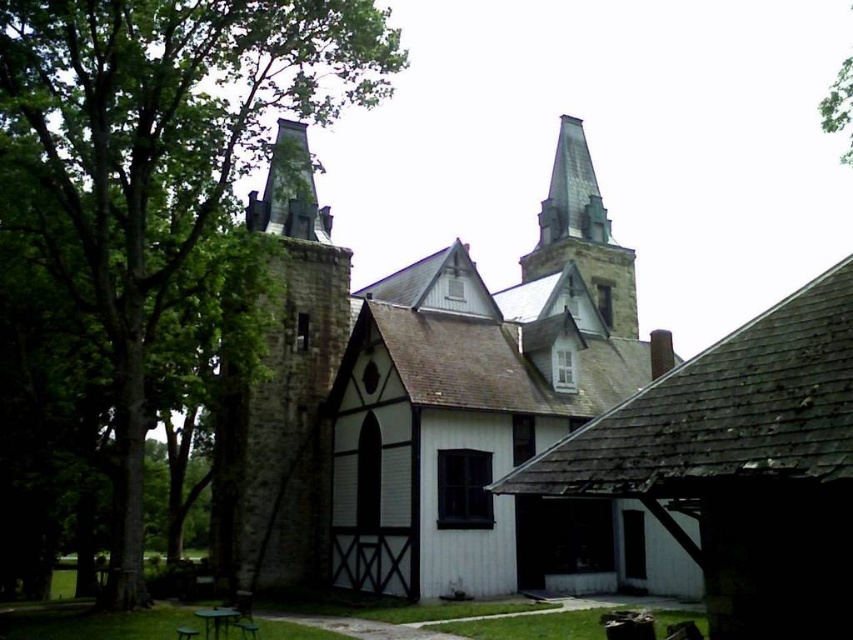
You are standing in front of the historic building and notice a green leafy tree at left and a gray stone steeple at upper center. Which object appears bigger in the scene?

The green leafy tree at left appears bigger than the gray stone steeple at upper center in the scene.